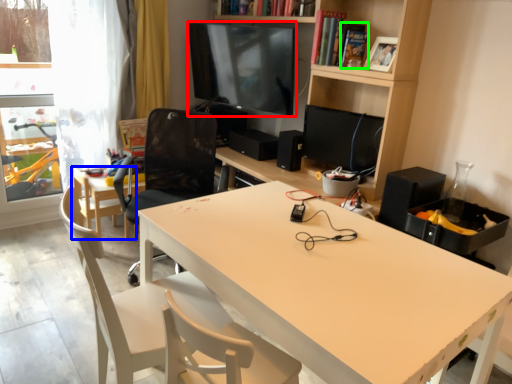
Question: Which object is positioned closest to television (highlighted by a red box)? Select from chair (highlighted by a blue box) and book (highlighted by a green box).

Choices:
 (A) chair
 (B) book

Answer: (B)